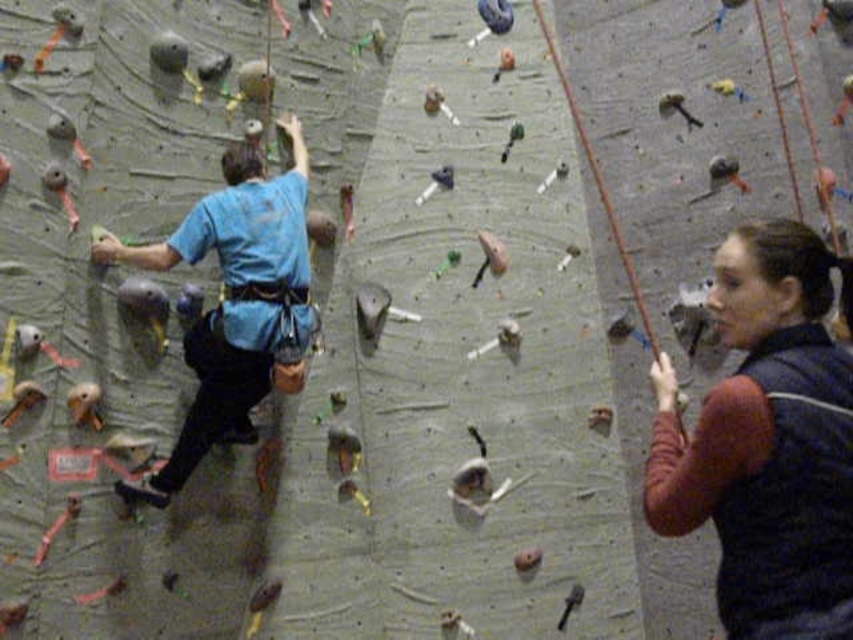
Question: Which of the following is the closest to the observer?

Choices:
 (A) (229, 266)
 (B) (807, 548)

Answer: (B)

Question: Does dark blue fleece vest at right have a greater width compared to blue fabric shirt at center?

Choices:
 (A) yes
 (B) no

Answer: (B)

Question: Which point appears farthest from the camera in this image?

Choices:
 (A) (796, 481)
 (B) (252, 349)

Answer: (B)

Question: Which point is farther to the camera?

Choices:
 (A) dark blue fleece vest at right
 (B) blue fabric shirt at center

Answer: (B)

Question: Does dark blue fleece vest at right have a smaller size compared to blue fabric shirt at center?

Choices:
 (A) no
 (B) yes

Answer: (B)

Question: Observing the image, what is the correct spatial positioning of dark blue fleece vest at right in reference to blue fabric shirt at center?

Choices:
 (A) above
 (B) below

Answer: (B)